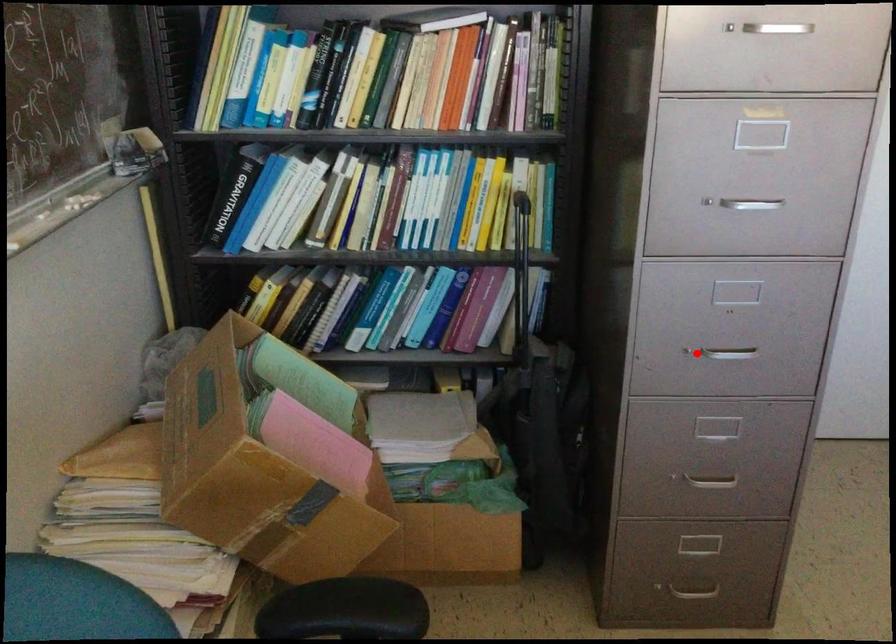
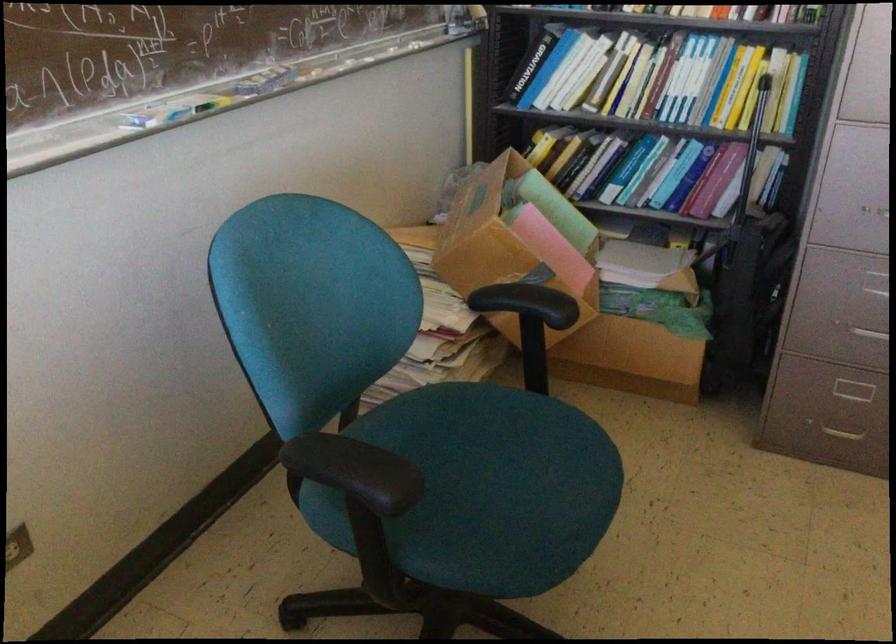
Question: I am providing you with two images of the same scene from different viewpoints. A red point is marked on the first image. At the location where the point appears in image 1, is it still visible in image 2?

Choices:
 (A) Yes
 (B) No

Answer: (A)